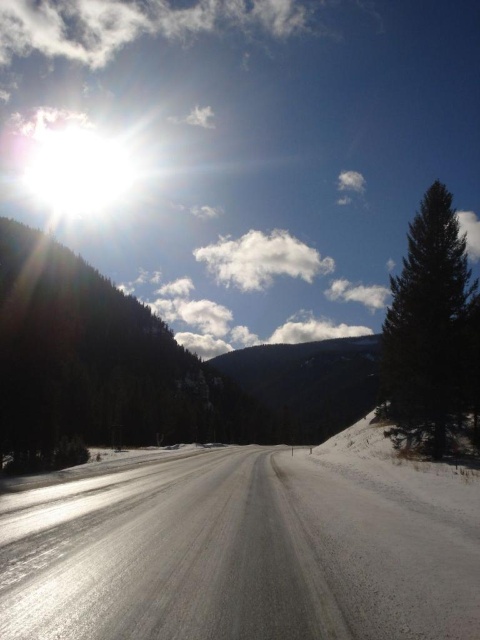
Does point (268, 481) come in front of point (85, 356)?

Yes, it is in front of point (85, 356).

The height and width of the screenshot is (640, 480). What are the coordinates of `white smooth road at center` in the screenshot? It's located at (248, 556).

Image resolution: width=480 pixels, height=640 pixels. What do you see at coordinates (248, 556) in the screenshot? I see `white smooth road at center` at bounding box center [248, 556].

Where is `white smooth road at center`? This screenshot has height=640, width=480. white smooth road at center is located at coordinates tap(248, 556).

Does white smooth road at center have a larger size compared to dark green coniferous tree at right?

Incorrect, white smooth road at center is not larger than dark green coniferous tree at right.

Image resolution: width=480 pixels, height=640 pixels. Identify the location of white smooth road at center. (248, 556).

Between green textured pine tree at left and dark green coniferous tree at right, which one appears on the left side from the viewer's perspective?

From the viewer's perspective, green textured pine tree at left appears more on the left side.

Does point (110, 332) lie in front of point (476, 410)?

No, it is behind (476, 410).

The image size is (480, 640). What are the coordinates of `green textured pine tree at left` in the screenshot? It's located at (97, 362).

At what (x,y) coordinates should I click in order to perform the action: click on green textured pine tree at left. Please return your answer as a coordinate pair (x, y). This screenshot has height=640, width=480. Looking at the image, I should click on (97, 362).